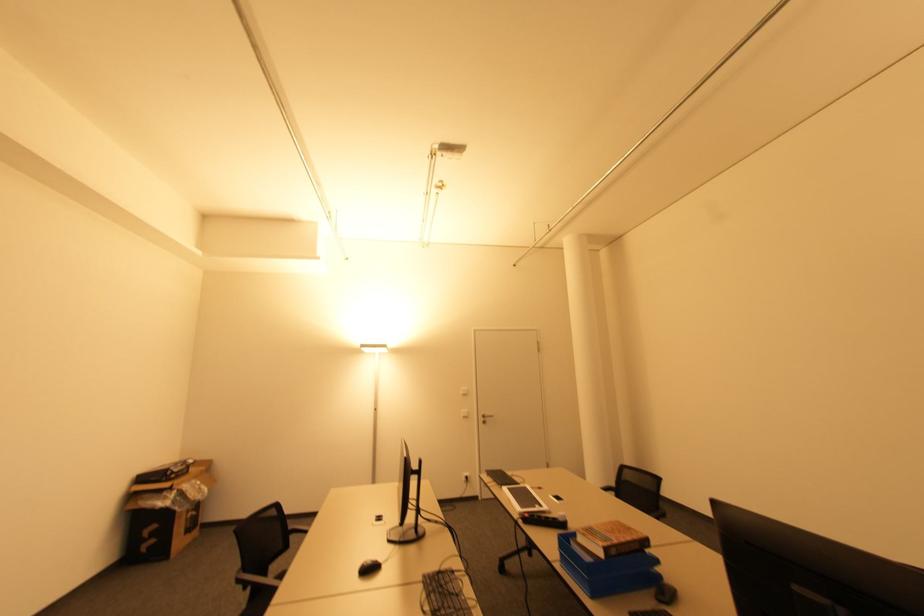
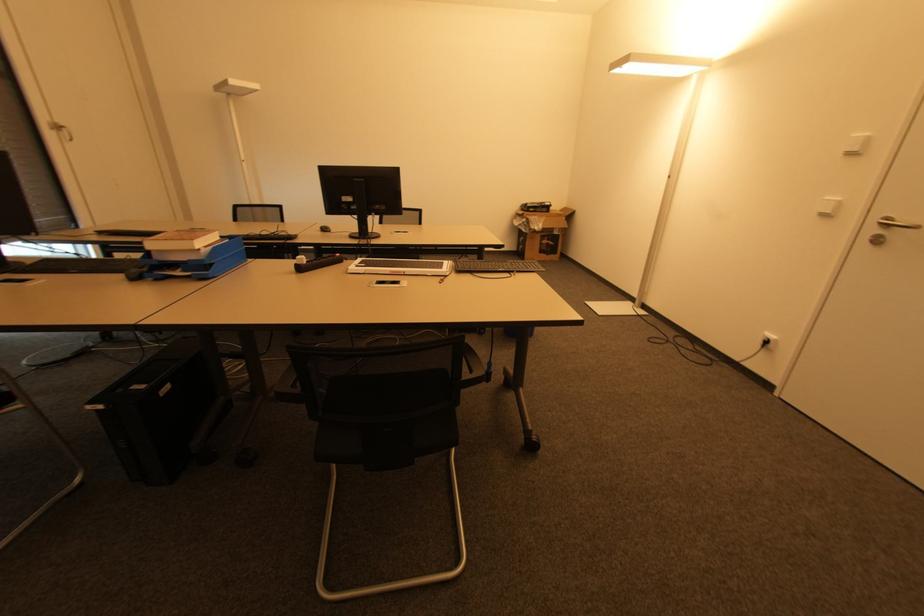
In the second image, find the point that corresponds to pixel 485 415 in the first image.

(890, 221)